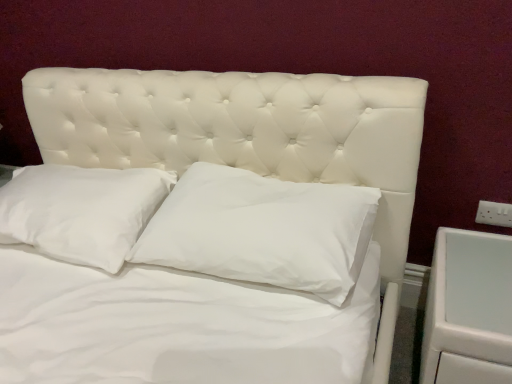
Question: Is white soft pillow at center, acting as the 1th pillow starting from the left, facing away from white plastic electric outlet at right?

Choices:
 (A) yes
 (B) no

Answer: (B)

Question: Is the position of white soft pillow at center, arranged as the 2th pillow when viewed from the right, more distant than that of white plastic electric outlet at right?

Choices:
 (A) no
 (B) yes

Answer: (A)

Question: Considering the relative sizes of white soft pillow at center, arranged as the 2th pillow when viewed from the right, and white plastic electric outlet at right in the image provided, is white soft pillow at center, arranged as the 2th pillow when viewed from the right, taller than white plastic electric outlet at right?

Choices:
 (A) yes
 (B) no

Answer: (A)

Question: From a real-world perspective, is white soft pillow at center, acting as the 1th pillow starting from the left, over white plastic electric outlet at right?

Choices:
 (A) yes
 (B) no

Answer: (A)

Question: From the image's perspective, is white soft pillow at center, acting as the 1th pillow starting from the left, located above white plastic electric outlet at right?

Choices:
 (A) yes
 (B) no

Answer: (A)

Question: Is white cotton pillow at center, which ranks as the first pillow in right-to-left order, spatially inside white soft pillow at center, acting as the 1th pillow starting from the left, or outside of it?

Choices:
 (A) inside
 (B) outside

Answer: (B)

Question: In terms of width, does white cotton pillow at center, which ranks as the first pillow in right-to-left order, look wider or thinner when compared to white soft pillow at center, acting as the 1th pillow starting from the left?

Choices:
 (A) thin
 (B) wide

Answer: (A)

Question: In terms of height, does white cotton pillow at center, which is the second pillow from left to right, look taller or shorter compared to white soft pillow at center, arranged as the 2th pillow when viewed from the right?

Choices:
 (A) tall
 (B) short

Answer: (A)

Question: From the image's perspective, is white cotton pillow at center, which is the second pillow from left to right, positioned above or below white soft pillow at center, acting as the 1th pillow starting from the left?

Choices:
 (A) below
 (B) above

Answer: (A)

Question: Considering the positions of white cotton pillow at center, which is the second pillow from left to right, and white glossy drawer at right in the image, is white cotton pillow at center, which is the second pillow from left to right, wider or thinner than white glossy drawer at right?

Choices:
 (A) wide
 (B) thin

Answer: (B)

Question: Is point (309, 218) closer or farther from the camera than point (434, 274)?

Choices:
 (A) closer
 (B) farther

Answer: (A)

Question: From the image's perspective, is white cotton pillow at center, which ranks as the first pillow in right-to-left order, located above or below white glossy drawer at right?

Choices:
 (A) above
 (B) below

Answer: (A)

Question: Based on their positions, is white cotton pillow at center, which is the second pillow from left to right, located to the left or right of white glossy drawer at right?

Choices:
 (A) left
 (B) right

Answer: (A)

Question: Is white soft pillow at center, arranged as the 2th pillow when viewed from the right, taller or shorter than white glossy drawer at right?

Choices:
 (A) tall
 (B) short

Answer: (B)

Question: In terms of width, does white soft pillow at center, arranged as the 2th pillow when viewed from the right, look wider or thinner when compared to white glossy drawer at right?

Choices:
 (A) wide
 (B) thin

Answer: (B)